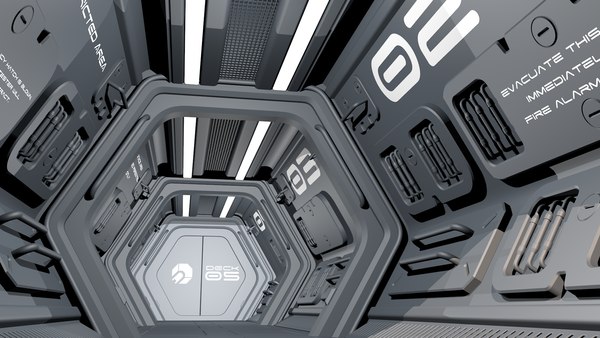
You are a GUI agent. You are given a task and a screenshot of the screen. Output one action in this format:
    pyautogui.click(x=<x>, y=<y>)
    Task: Click on the alarm
    This screenshot has width=600, height=338.
    Given the screenshot: What is the action you would take?
    pyautogui.click(x=558, y=98), pyautogui.click(x=565, y=98), pyautogui.click(x=576, y=92), pyautogui.click(x=581, y=86), pyautogui.click(x=593, y=83)